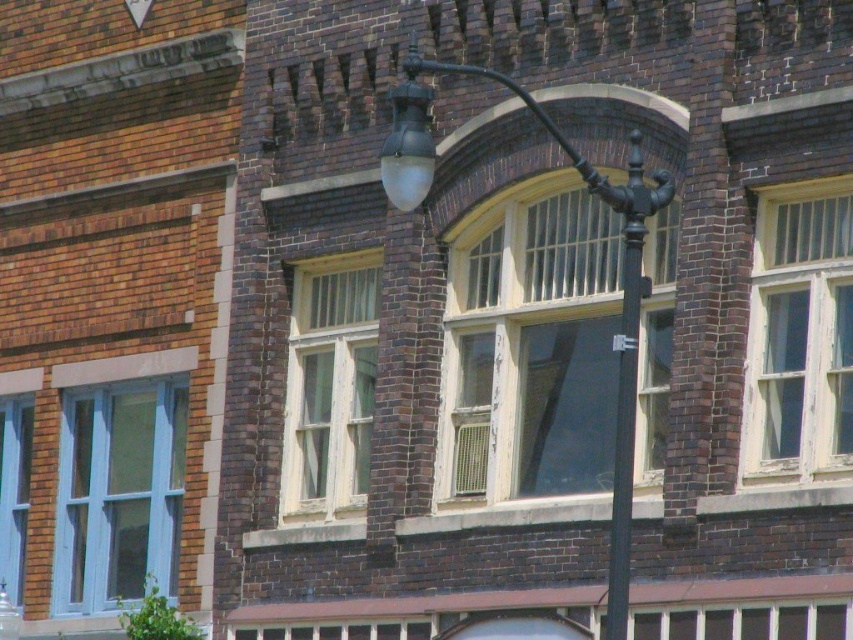
Does white wood window at center have a greater width compared to light blue glass window at left?

Indeed, white wood window at center has a greater width compared to light blue glass window at left.

Looking at this image, can you confirm if white wood window at center is positioned to the right of light blue glass window at left?

Indeed, white wood window at center is positioned on the right side of light blue glass window at left.

Locate an element on the screen. white wood window at center is located at coordinates (329, 387).

Identify the location of white wood window at center. This screenshot has width=853, height=640. (329, 387).

Which is more to the right, blue painted wood window at left or brown brick sign at upper left?

brown brick sign at upper left is more to the right.

What do you see at coordinates (119, 492) in the screenshot?
I see `blue painted wood window at left` at bounding box center [119, 492].

The width and height of the screenshot is (853, 640). Find the location of `blue painted wood window at left`. blue painted wood window at left is located at coordinates (119, 492).

The height and width of the screenshot is (640, 853). I want to click on blue painted wood window at left, so click(x=119, y=492).

Find the location of a particular element. white wood window at center is located at coordinates (329, 387).

Does white wood window at center have a smaller size compared to matte black street light at center?

Yes, white wood window at center is smaller than matte black street light at center.

Where is `white wood window at center`? The image size is (853, 640). white wood window at center is located at coordinates (329, 387).